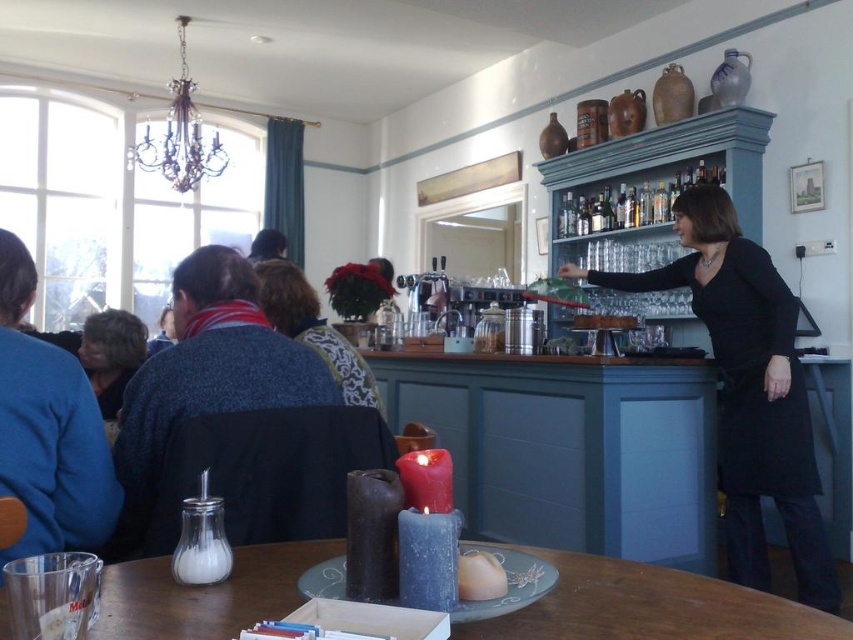
You are standing at the entrance of the cafe and want to take a photo of the point at coordinates (590, 456). The camera you are using has a maximum focus range of 3 meters. Will the camera be able to focus on that point?

The distance of point (590, 456) from the camera is 2.77 meters, which is within the camera maximum focus range of 3 meters. Therefore, the camera can focus on that point.

You are a customer sitting at the smooth wooden table at center in the cozy indoor setting. You want to reach for the shiny glass bottles at upper center without leaving your seat. Can you comfortably reach them while sitting at the table?

The smooth wooden table at center has a greater height compared to shiny glass bottles at upper center. Since the table is taller than the bottles, the bottles are positioned lower than the table surface, making them easier to reach while sitting. Therefore, you can comfortably reach the shiny glass bottles at upper center without leaving your seat.